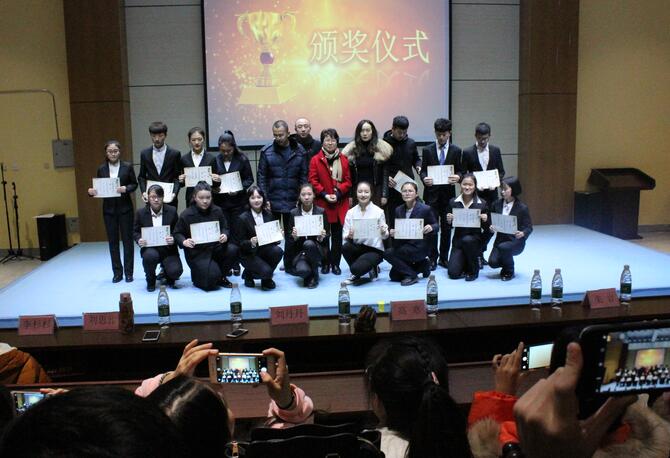
I want to click on projector screen, so click(342, 87).